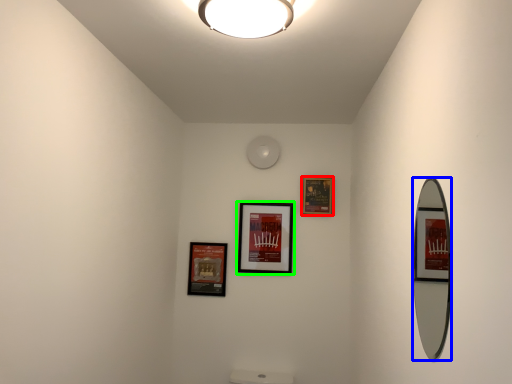
Question: Based on their relative distances, which object is nearer to picture frame (highlighted by a red box)? Choose from mirror (highlighted by a blue box) and picture frame (highlighted by a green box).

Choices:
 (A) mirror
 (B) picture frame

Answer: (B)